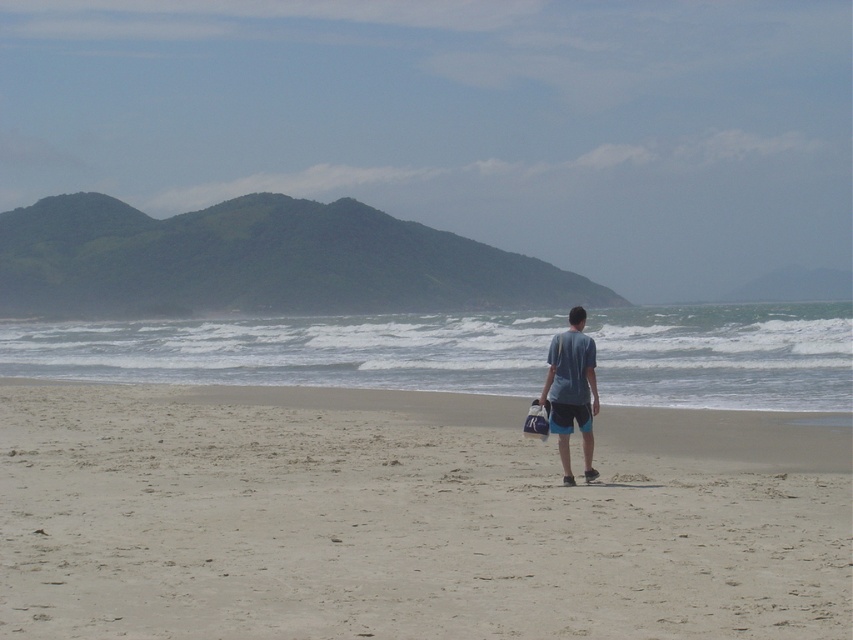
Which of these two, light beige sand at center or blue cotton shirt at center, stands shorter?

Standing shorter between the two is light beige sand at center.

Who is lower down, light beige sand at center or blue cotton shirt at center?

Positioned lower is light beige sand at center.

This screenshot has height=640, width=853. Describe the element at coordinates (409, 516) in the screenshot. I see `light beige sand at center` at that location.

Find the location of a particular element. light beige sand at center is located at coordinates (409, 516).